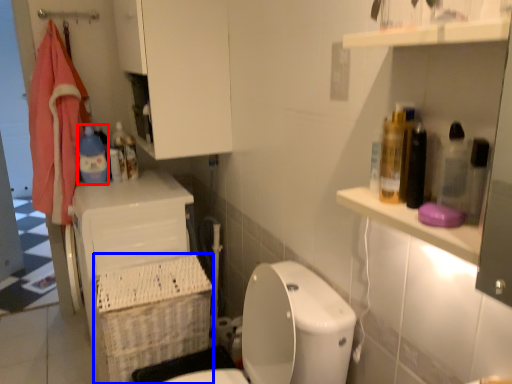
Question: Which object is further to the camera taking this photo, cleaning product (highlighted by a red box) or basket (highlighted by a blue box)?

Choices:
 (A) cleaning product
 (B) basket

Answer: (A)